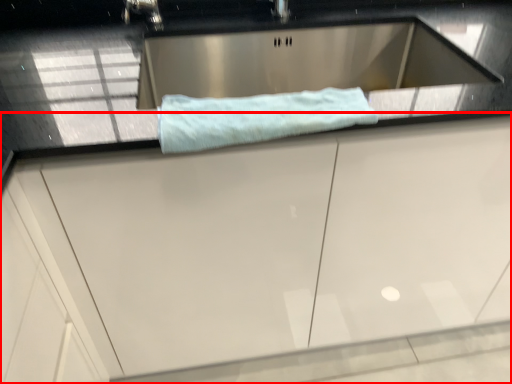
Question: Observing the image, what is the correct spatial positioning of cabinetry (annotated by the red box) in reference to bath towel?

Choices:
 (A) left
 (B) right

Answer: (B)